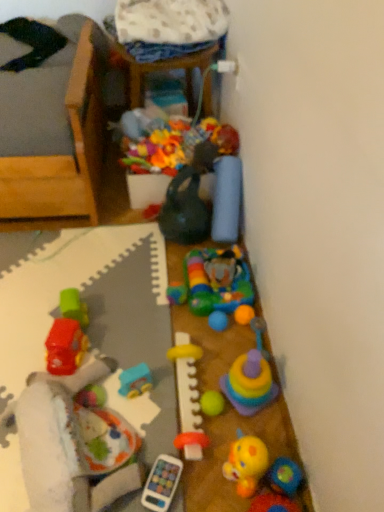
Locate an element on the screen. free spot to the right of blue plastic toy car at center, which is the second toy from left to right is located at coordinates (195, 388).